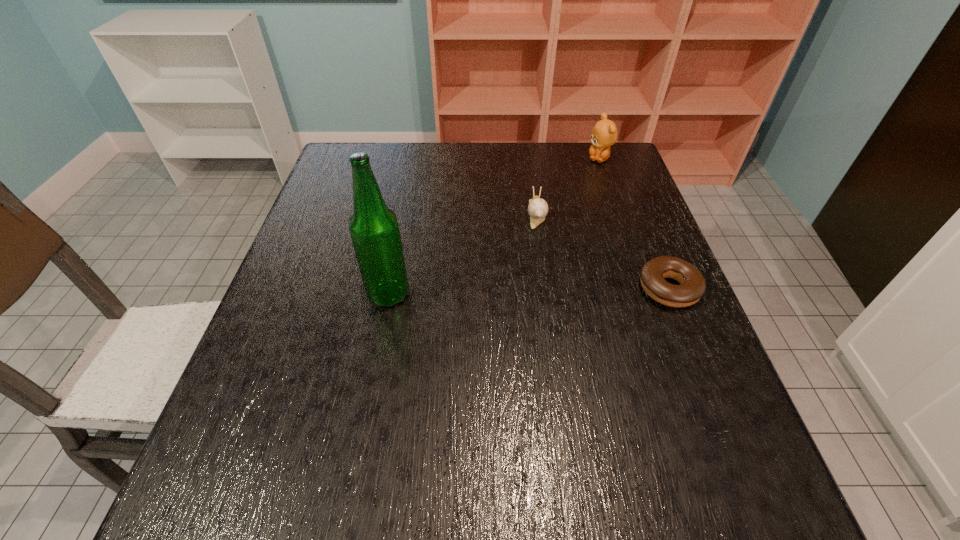
Where is `beer bottle`? The width and height of the screenshot is (960, 540). beer bottle is located at coordinates (374, 229).

I want to click on the tallest object, so click(374, 229).

Locate an element on the screen. doughnut is located at coordinates (693, 286).

Where is `the third object from right to left`? The width and height of the screenshot is (960, 540). the third object from right to left is located at coordinates (538, 208).

This screenshot has height=540, width=960. Find the location of `the second farthest object`. the second farthest object is located at coordinates (538, 208).

Locate an element on the screen. The height and width of the screenshot is (540, 960). teddy bear is located at coordinates (604, 134).

Where is `the third shortest object`? The height and width of the screenshot is (540, 960). the third shortest object is located at coordinates (604, 134).

Identify the location of vacant space located on the label of the leftmost object. (286, 294).

Where is `vacant space located on the label of the leftmost object`? This screenshot has width=960, height=540. vacant space located on the label of the leftmost object is located at coordinates (304, 294).

This screenshot has height=540, width=960. Find the location of `vacant area located on the label of the leftmost object`. vacant area located on the label of the leftmost object is located at coordinates (296, 294).